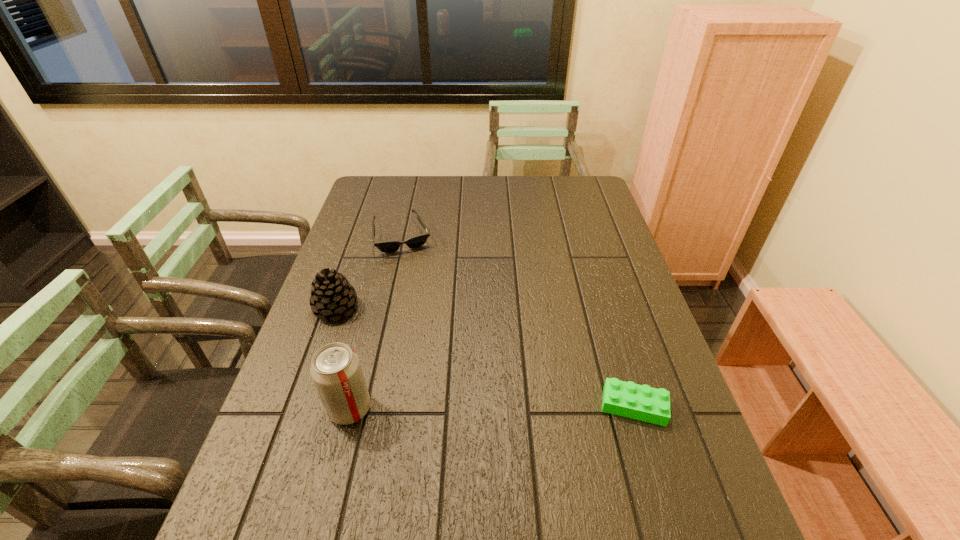
Locate an element on the screen. Image resolution: width=960 pixels, height=540 pixels. vacant spot on the desktop that is between the soda can and the rightmost object and is positioned at the narrow end of the pinecone is located at coordinates (483, 407).

Where is `vacant space on the desktop that is between the tallest object and the rightmost object and is positioned on the front-facing side of the farthest object`? Image resolution: width=960 pixels, height=540 pixels. vacant space on the desktop that is between the tallest object and the rightmost object and is positioned on the front-facing side of the farthest object is located at coordinates (458, 408).